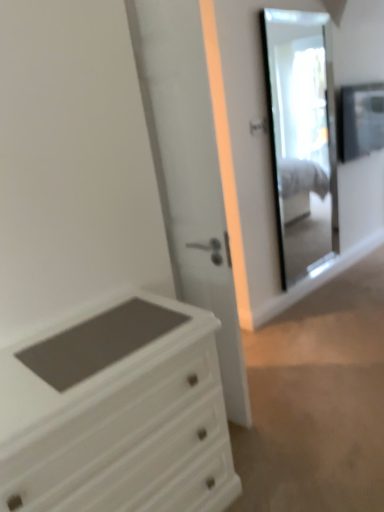
Question: Is matte black frame at upper right surrounding white glossy door at center?

Choices:
 (A) no
 (B) yes

Answer: (A)

Question: Is matte black frame at upper right positioned before white glossy door at center?

Choices:
 (A) yes
 (B) no

Answer: (B)

Question: Is matte black frame at upper right not near white glossy door at center?

Choices:
 (A) no
 (B) yes

Answer: (B)

Question: From a real-world perspective, is matte black frame at upper right below white glossy door at center?

Choices:
 (A) no
 (B) yes

Answer: (A)

Question: Is matte black frame at upper right at the left side of white glossy door at center?

Choices:
 (A) no
 (B) yes

Answer: (A)

Question: From the image's perspective, is matte black frame at upper right above white glossy door at center?

Choices:
 (A) no
 (B) yes

Answer: (B)

Question: Is clear glass mirror at upper right taller than white glossy door at center?

Choices:
 (A) yes
 (B) no

Answer: (B)

Question: Can you confirm if clear glass mirror at upper right is smaller than white glossy door at center?

Choices:
 (A) no
 (B) yes

Answer: (B)

Question: Considering the relative sizes of clear glass mirror at upper right and white glossy door at center in the image provided, is clear glass mirror at upper right shorter than white glossy door at center?

Choices:
 (A) no
 (B) yes

Answer: (B)

Question: From a real-world perspective, does clear glass mirror at upper right sit lower than white glossy door at center?

Choices:
 (A) no
 (B) yes

Answer: (A)

Question: Is clear glass mirror at upper right aimed at white glossy door at center?

Choices:
 (A) no
 (B) yes

Answer: (A)

Question: Is clear glass mirror at upper right at the left side of white glossy door at center?

Choices:
 (A) yes
 (B) no

Answer: (B)

Question: Does matte black frame at upper right have a lesser height compared to clear glass mirror at upper right?

Choices:
 (A) yes
 (B) no

Answer: (A)